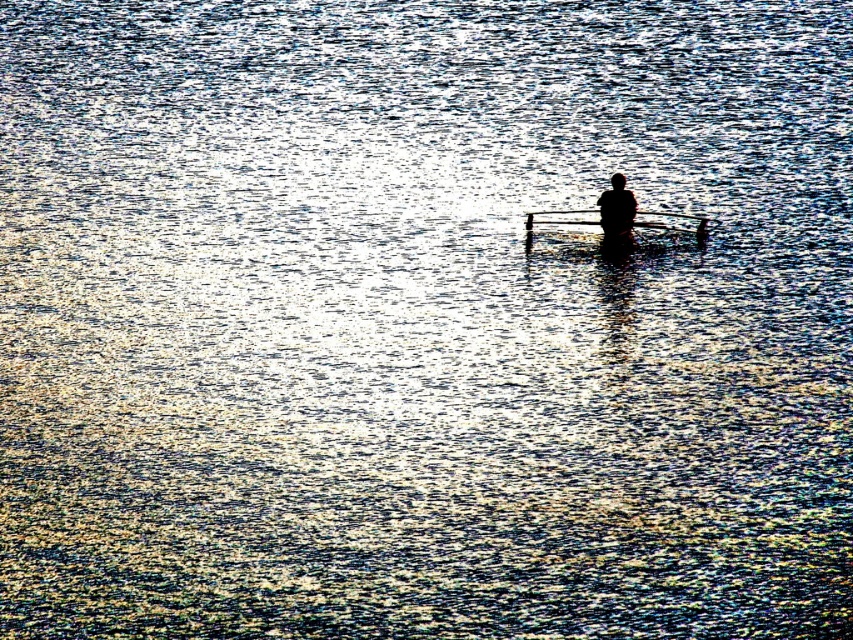
Question: Considering the relative positions of smooth wood canoe at center and black matte figure at center in the image provided, where is smooth wood canoe at center located with respect to black matte figure at center?

Choices:
 (A) below
 (B) above

Answer: (A)

Question: Which of the following is the closest to the observer?

Choices:
 (A) (630, 192)
 (B) (575, 221)

Answer: (A)

Question: Estimate the real-world distances between objects in this image. Which object is closer to the black matte figure at center?

Choices:
 (A) transparent plastic paddle at center
 (B) smooth wood canoe at center

Answer: (B)

Question: Which point is closer to the camera?

Choices:
 (A) (564, 216)
 (B) (619, 228)
 (C) (691, 225)

Answer: (B)

Question: Can you confirm if transparent plastic paddle at center is positioned above black matte figure at center?

Choices:
 (A) yes
 (B) no

Answer: (B)

Question: Does transparent plastic paddle at center have a larger size compared to black matte figure at center?

Choices:
 (A) no
 (B) yes

Answer: (B)